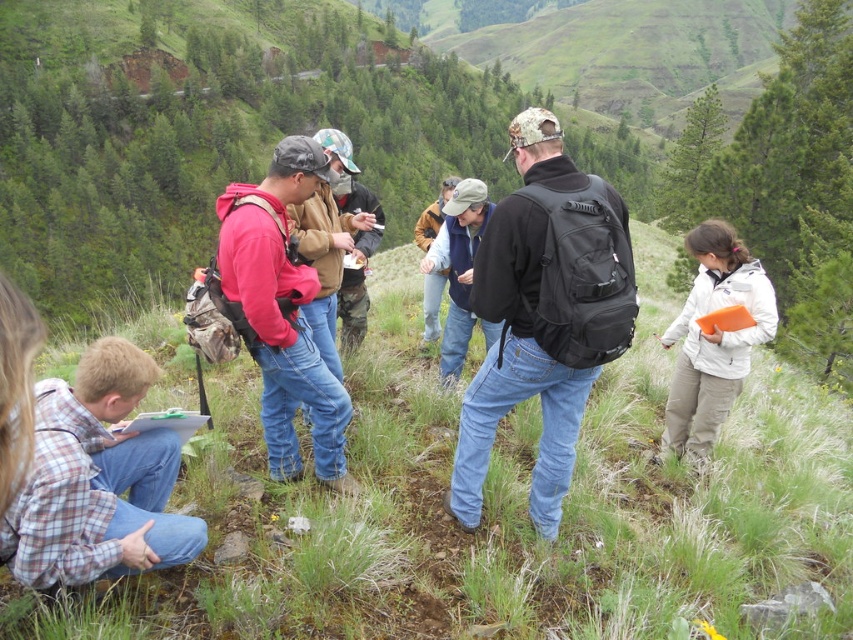
Looking at this image, you are a photographer trying to capture a clear shot of the denim jacket at center without the plaid cotton shirt at lower left blocking it. What should you do?

Move your camera position to the right or left to reframe the shot so the plaid cotton shirt at lower left is no longer in front of the denim jacket at center.

You are a photographer trying to capture a clear shot of the plaid cotton shirt at lower left without the black matte backpack at center blocking the view. Based on their positions, can you position yourself to the left or right of the backpack to achieve this?

The black matte backpack at center is positioned on the right side of plaid cotton shirt at lower left. To avoid the backpack blocking the view, you should position yourself to the left of the backpack.

You are planning to take a photo of the matte red hoodie at center and the white matte jacket at right. Which of the two items has a greater width?

The matte red hoodie at center has a greater width than the white matte jacket at right.